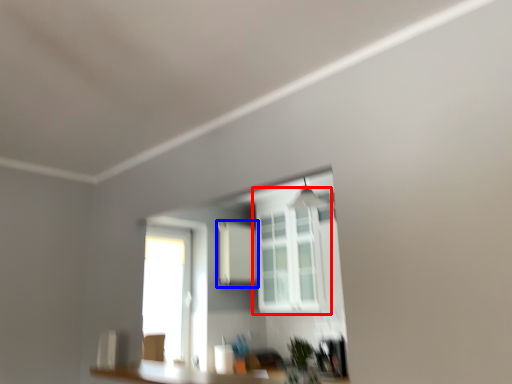
Question: Which object appears closest to the camera in this image, window (highlighted by a red box) or medicine cabinet (highlighted by a blue box)?

Choices:
 (A) window
 (B) medicine cabinet

Answer: (A)